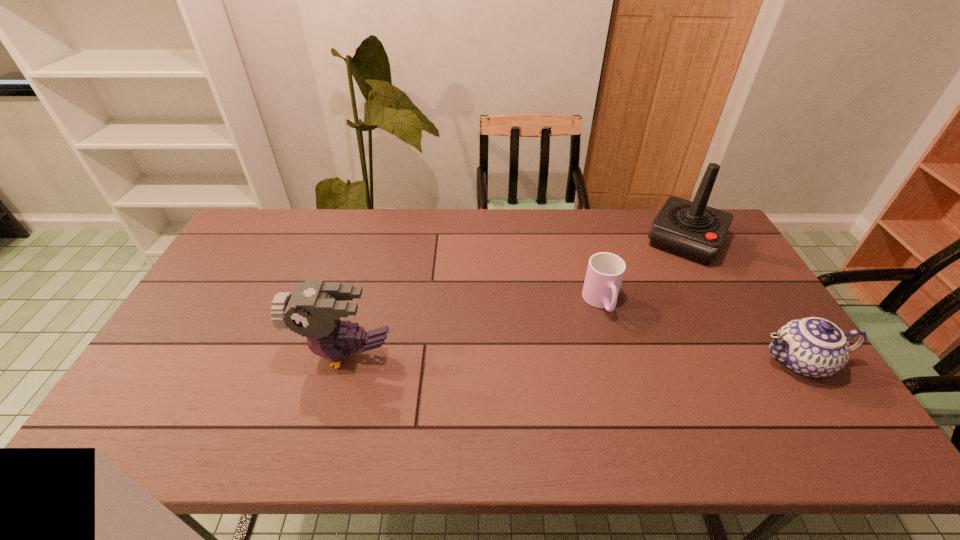
Where is `vacant area between the third object from right to left and the chinaware`? This screenshot has width=960, height=540. vacant area between the third object from right to left and the chinaware is located at coordinates 700,332.

Identify the location of free space between the joystick and the third shortest object. (516, 298).

Identify the location of vacant area that lies between the cup and the chinaware. point(700,332).

This screenshot has height=540, width=960. I want to click on blank region between the second object from left to right and the chinaware, so click(700, 332).

I want to click on free space between the joystick and the bird, so click(516, 298).

The width and height of the screenshot is (960, 540). I want to click on free space between the second object from left to right and the farthest object, so click(643, 272).

Find the location of `vacant point located between the bird and the chinaware`. vacant point located between the bird and the chinaware is located at coordinates (572, 358).

The image size is (960, 540). I want to click on unoccupied area between the farthest object and the cup, so click(643, 272).

Identify the location of vacant space that's between the cup and the leftmost object. (473, 328).

The height and width of the screenshot is (540, 960). Identify the location of free spot between the third shortest object and the second farthest object. (473, 328).